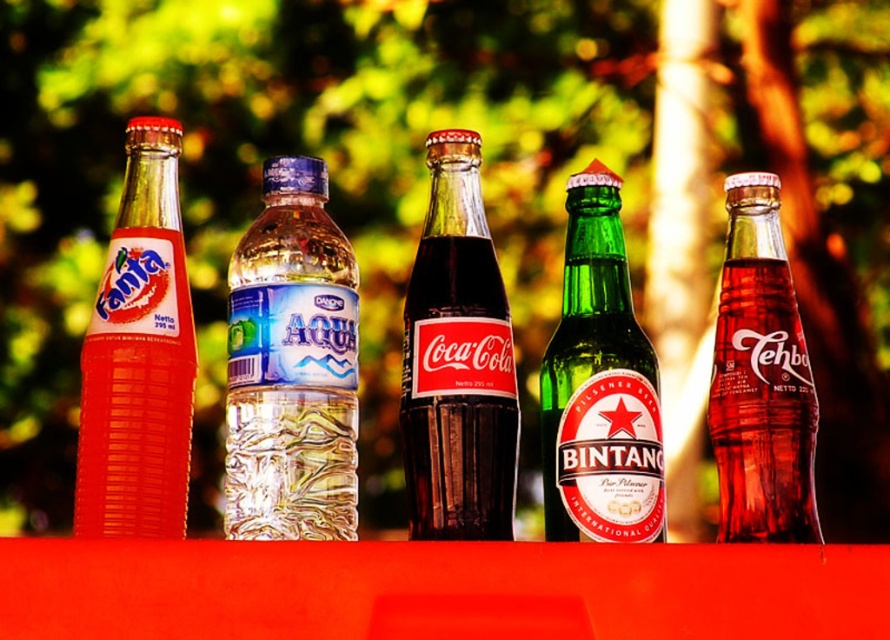
Question: Which object is farther from the camera taking this photo?

Choices:
 (A) dark glass coca-cola bottle at center
 (B) green glass beer at center
 (C) translucent glass bottle at center
 (D) translucent glass fanta bottle at left

Answer: (C)

Question: Estimate the real-world distances between objects in this image. Which object is closer to the translucent glass bottle at center?

Choices:
 (A) green glass beer at center
 (B) clear plastic bottle at center
 (C) translucent glass fanta bottle at left

Answer: (A)

Question: Is dark glass coca-cola bottle at center to the left of translucent glass bottle at center from the viewer's perspective?

Choices:
 (A) yes
 (B) no

Answer: (A)

Question: Is translucent glass fanta bottle at left to the left of green glass beer at center from the viewer's perspective?

Choices:
 (A) no
 (B) yes

Answer: (B)

Question: Does clear plastic bottle at center have a greater width compared to green glass beer at center?

Choices:
 (A) no
 (B) yes

Answer: (B)

Question: Which is farther from the translucent glass bottle at center?

Choices:
 (A) translucent glass fanta bottle at left
 (B) green glass beer at center
 (C) dark glass coca-cola bottle at center

Answer: (A)